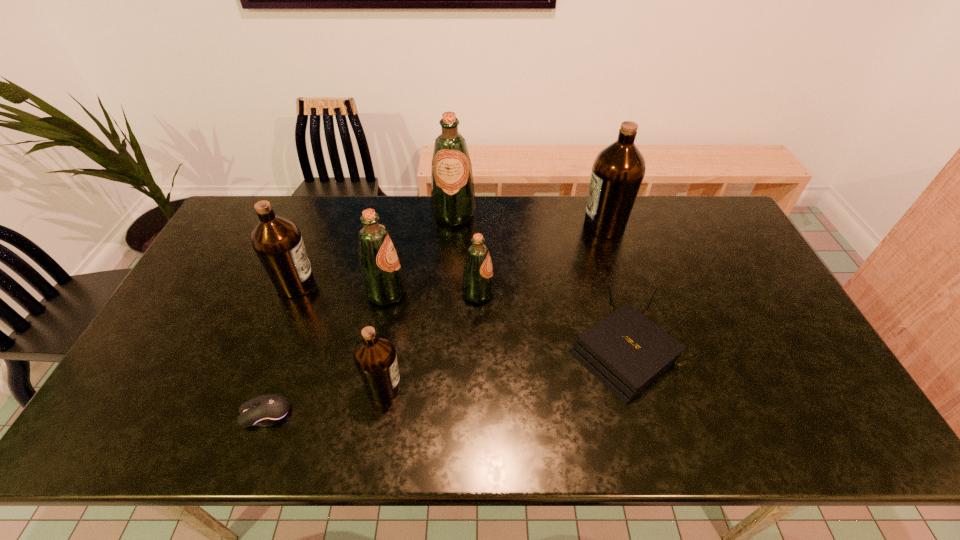
Locate an element on the screen. The width and height of the screenshot is (960, 540). router is located at coordinates (626, 351).

This screenshot has height=540, width=960. I want to click on the shortest object, so click(x=268, y=410).

Identify the location of black computer mouse. This screenshot has height=540, width=960. (268, 410).

Find the location of a particular element. The image size is (960, 540). free spot located on the label of the biggest brown olive oil is located at coordinates (512, 226).

The image size is (960, 540). Identify the location of vacant region located on the label of the biggest brown olive oil. pyautogui.click(x=477, y=226).

Find the location of a particular element. vacant space located 0.220m on the label of the biggest brown olive oil is located at coordinates [x=517, y=226].

Identify the location of free location located on the front-facing side of the farthest green olive oil. (449, 294).

At what (x,y) coordinates should I click in order to perform the action: click on free space located on the front-facing side of the second smallest green olive oil. Please return your answer as a coordinate pair (x, y). The height and width of the screenshot is (540, 960). Looking at the image, I should click on (512, 293).

This screenshot has width=960, height=540. Find the location of `vacant space located on the label of the second smallest brown olive oil`. vacant space located on the label of the second smallest brown olive oil is located at coordinates (349, 285).

Find the location of `free space located on the front-facing side of the smallest green olive oil`. free space located on the front-facing side of the smallest green olive oil is located at coordinates (598, 294).